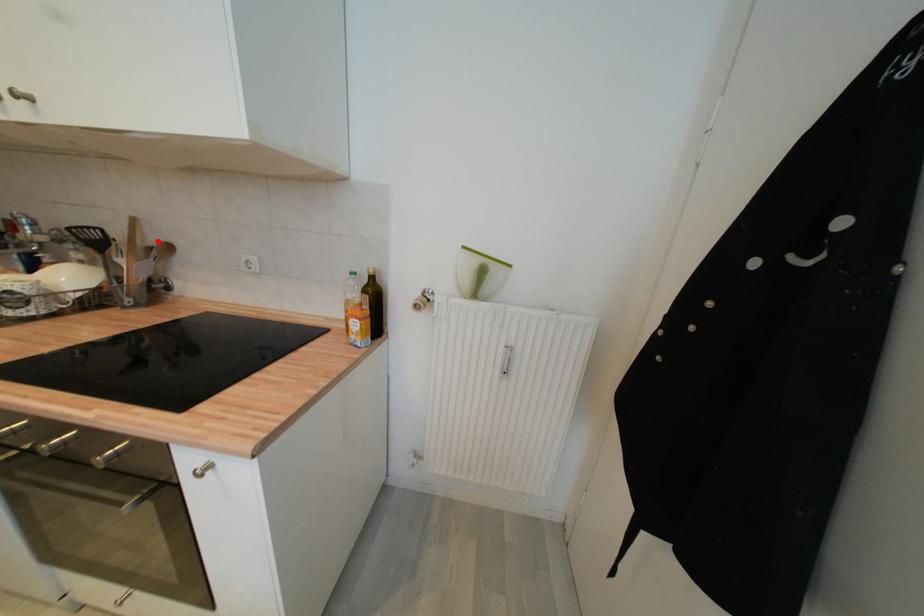
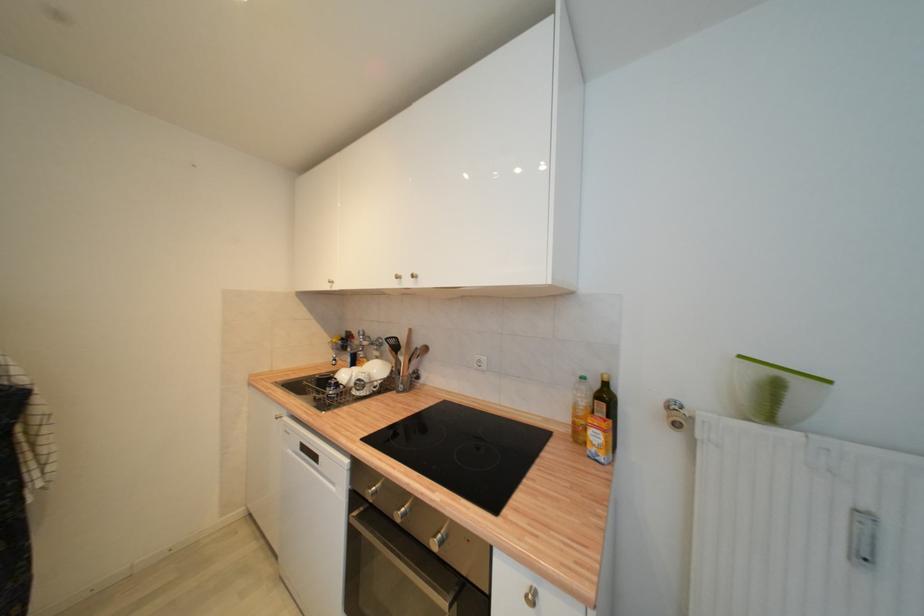
The point at the highlighted location is marked in the first image. Where is the corresponding point in the second image?

(422, 345)